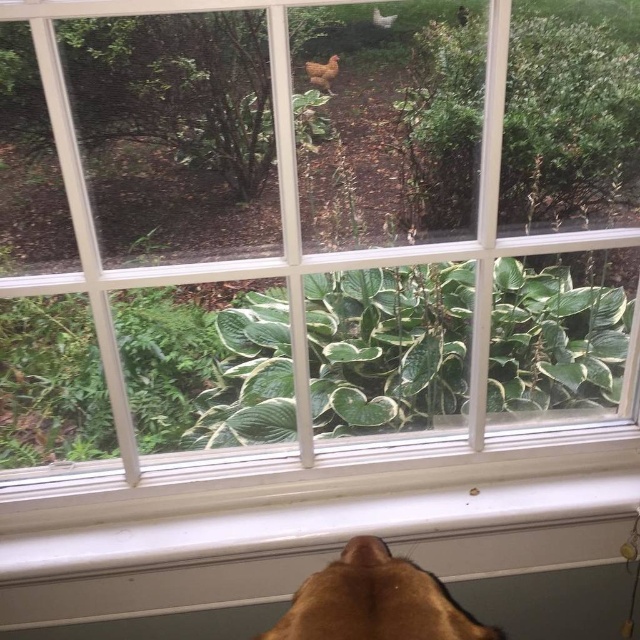
Question: Does green leafy plant at center have a larger size compared to brown furry dog at bottom?

Choices:
 (A) no
 (B) yes

Answer: (B)

Question: Which point is farther from the camera taking this photo?

Choices:
 (A) (515, 372)
 (B) (428, 573)

Answer: (A)

Question: Based on their relative distances, which object is nearer to the green leafy plant at upper center?

Choices:
 (A) brown furry dog at bottom
 (B) green leafy plant at center

Answer: (B)

Question: Does green leafy plant at upper center appear over brown furry dog at bottom?

Choices:
 (A) no
 (B) yes

Answer: (B)

Question: Can you confirm if green leafy plant at upper center is positioned to the left of brown furry dog at bottom?

Choices:
 (A) no
 (B) yes

Answer: (A)

Question: Among these points, which one is nearest to the camera?

Choices:
 (A) (560, 212)
 (B) (330, 420)

Answer: (B)